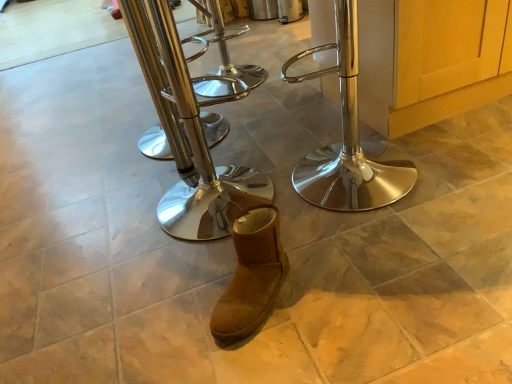
Find the location of `free space in front of polished chrome stool at center, the second step stool when ordered from left to right`. free space in front of polished chrome stool at center, the second step stool when ordered from left to right is located at coordinates (196, 285).